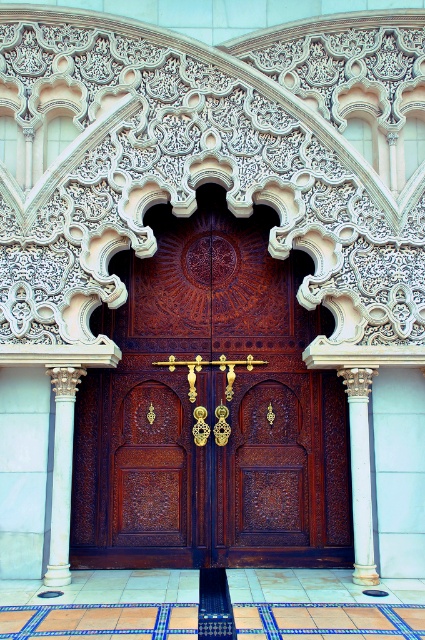
Question: Which object is the farthest from the polished wood door at center?

Choices:
 (A) white marble column at center
 (B) white marble column at left

Answer: (B)

Question: Can you confirm if polished wood door at center is smaller than white marble column at left?

Choices:
 (A) yes
 (B) no

Answer: (B)

Question: Among these objects, which one is farthest from the camera?

Choices:
 (A) white marble column at center
 (B) polished wood door at center
 (C) white marble column at left

Answer: (B)

Question: Is polished wood door at center behind white marble column at center?

Choices:
 (A) yes
 (B) no

Answer: (A)

Question: Which object is the farthest from the white marble column at center?

Choices:
 (A) white marble column at left
 (B) polished wood door at center

Answer: (A)

Question: Is polished wood door at center bigger than white marble column at left?

Choices:
 (A) no
 (B) yes

Answer: (B)